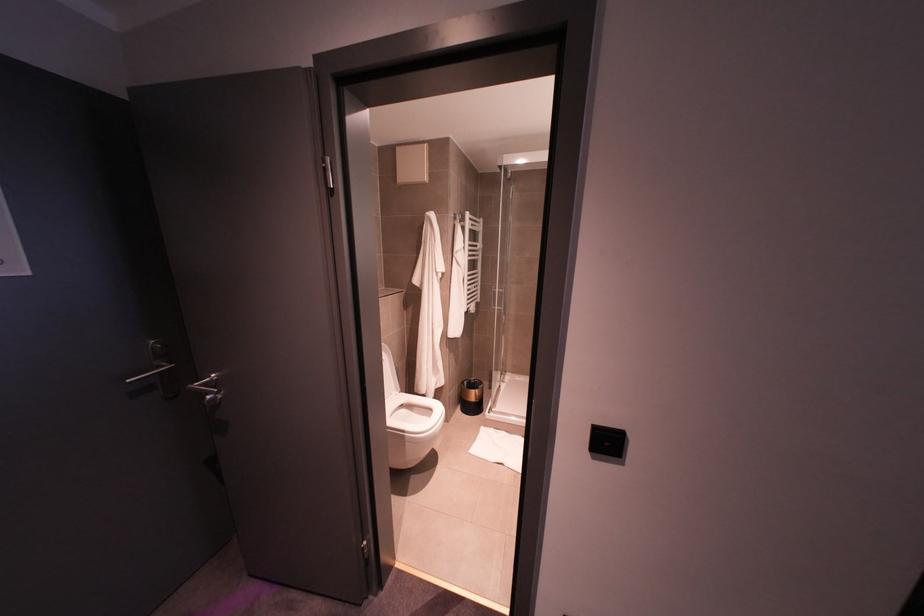
Locate an element on the screen. The image size is (924, 616). silver door lock is located at coordinates (150, 373).